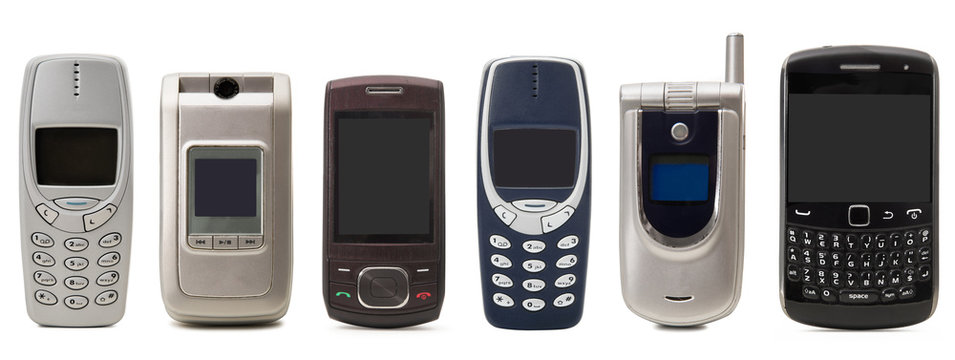
Identify the location of phone screen. This screenshot has height=360, width=955. (74, 136), (205, 173), (349, 174), (505, 143), (685, 177), (890, 138).